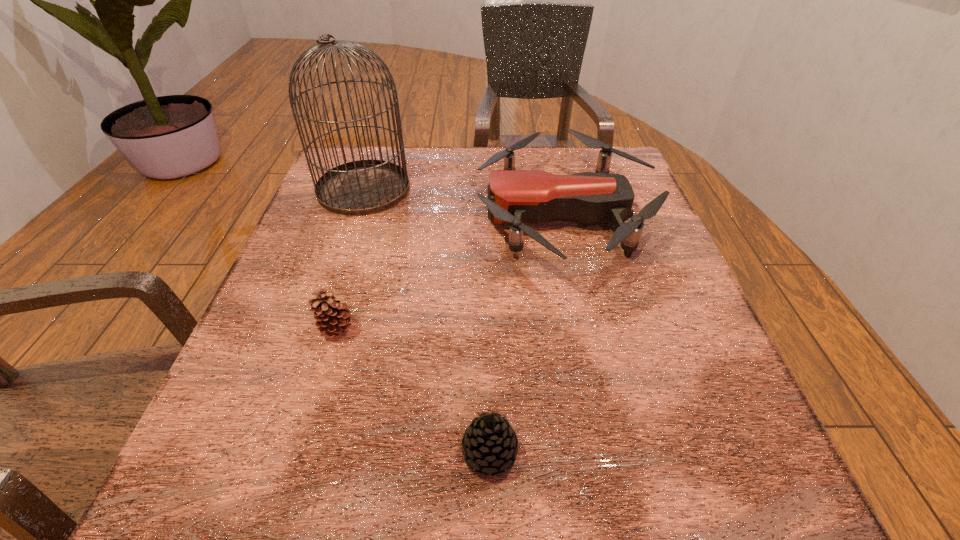
You are a GUI agent. You are given a task and a screenshot of the screen. Output one action in this format:
    pyautogui.click(x=<x>, y=<y>)
    Task: Click on the free spot between the tallest object and the nearer pinecone
    
    Given the screenshot: What is the action you would take?
    pyautogui.click(x=426, y=320)

Find the location of a particular element. The image size is (960, 540). vacant point located between the tallest object and the left pinecone is located at coordinates (350, 258).

Identify the location of free space between the nearer pinecone and the birdcage. (426, 320).

The width and height of the screenshot is (960, 540). I want to click on free space that is in between the right pinecone and the second nearest object, so pyautogui.click(x=413, y=389).

I want to click on vacant space that's between the drone and the birdcage, so click(464, 202).

You are a GUI agent. You are given a task and a screenshot of the screen. Output one action in this format:
    pyautogui.click(x=<x>, y=<y>)
    Task: Click on the vacant area between the birdcage and the left pinecone
    The height and width of the screenshot is (540, 960).
    Given the screenshot: What is the action you would take?
    pyautogui.click(x=350, y=258)

Find the location of `free space between the birdcage and the drone`. free space between the birdcage and the drone is located at coordinates (464, 202).

The width and height of the screenshot is (960, 540). Identify the location of the third closest object to the nearer pinecone. (363, 187).

Choose which object is the nearest neighbor to the shorter pinecone. Please provide its 2D coordinates. Your answer should be formatted as a tuple, i.e. [(x, y)], where the tuple contains the x and y coordinates of a point satisfying the conditions above.

[(332, 317)]

Where is `free point that satisfies the following two spatial constraints: 1. on the front-facing side of the drone; 2. on the front side of the second nearest object`? free point that satisfies the following two spatial constraints: 1. on the front-facing side of the drone; 2. on the front side of the second nearest object is located at coordinates (590, 327).